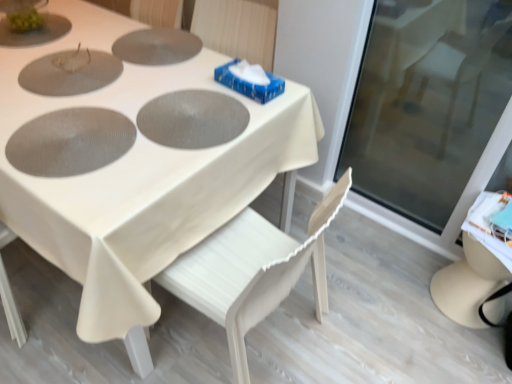
Locate an element on the screen. free space in front of matte gray pizza pan at upper center, which is the 3th pizza pan from front to back is located at coordinates click(x=151, y=79).